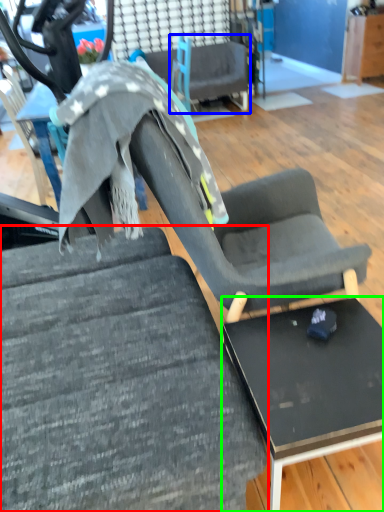
Question: Which object is positioned closest to chair (highlighted by a red box)? Select from chair (highlighted by a blue box) and table (highlighted by a green box).

Choices:
 (A) chair
 (B) table

Answer: (B)